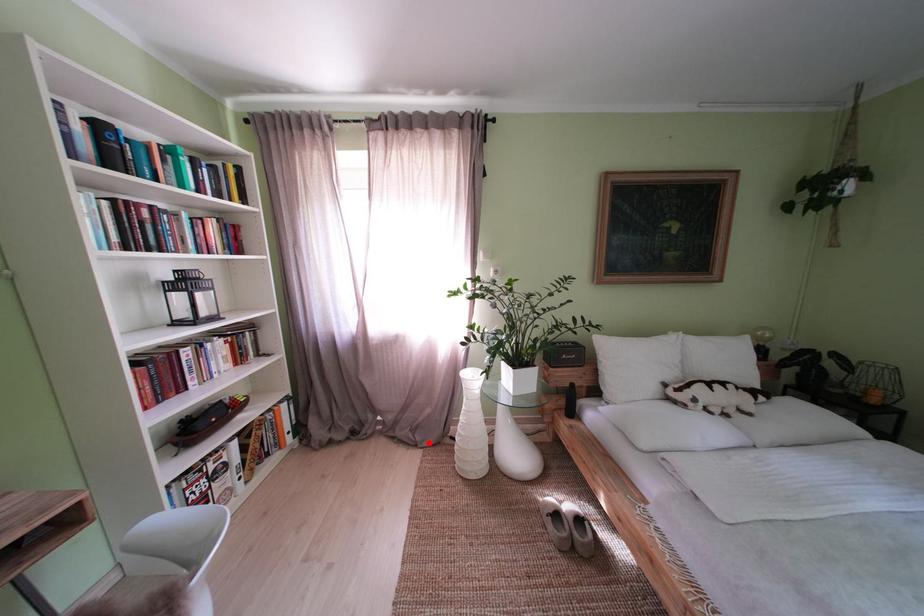
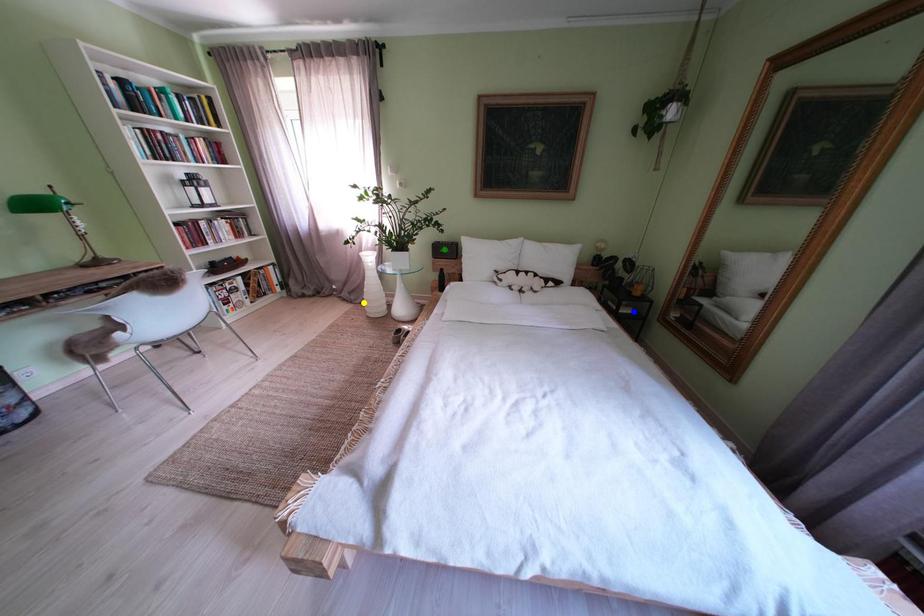
Question: I am providing you with two images of the same scene from different viewpoints. A red point is marked on the first image. You are given multiple points on the second image. Which point in image 2 represents the same 3d spot as the red point in image 1?

Choices:
 (A) blue point
 (B) green point
 (C) yellow point

Answer: (C)